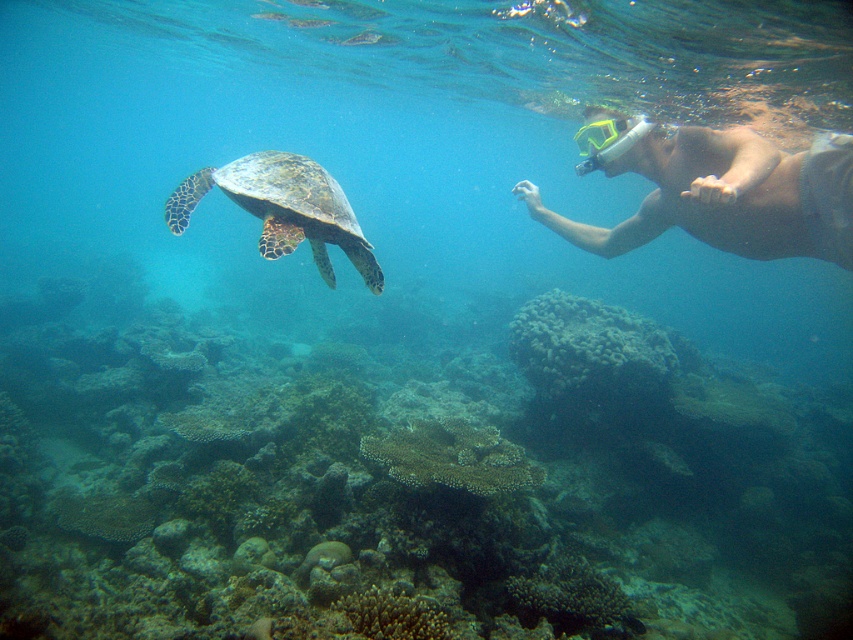
Question: Among these points, which one is nearest to the camera?

Choices:
 (A) (224, 180)
 (B) (606, 147)
 (C) (619, 136)

Answer: (A)

Question: Where is brown coral reef at center located in relation to smooth skin diver at right in the image?

Choices:
 (A) right
 (B) left

Answer: (B)

Question: Can you confirm if smooth skin diver at right is positioned above yellow-green plastic snorkel mask at upper right?

Choices:
 (A) no
 (B) yes

Answer: (A)

Question: Can you confirm if brown coral reef at center is smaller than leathery greenish-brown turtle at left?

Choices:
 (A) yes
 (B) no

Answer: (B)

Question: Which object appears farthest from the camera in this image?

Choices:
 (A) leathery greenish-brown turtle at left
 (B) brown coral reef at center
 (C) yellow-green plastic snorkel mask at upper right

Answer: (C)

Question: Which point is farther from the camera taking this photo?

Choices:
 (A) (834, 168)
 (B) (381, 285)
 (C) (624, 145)
 (D) (302, 369)

Answer: (D)